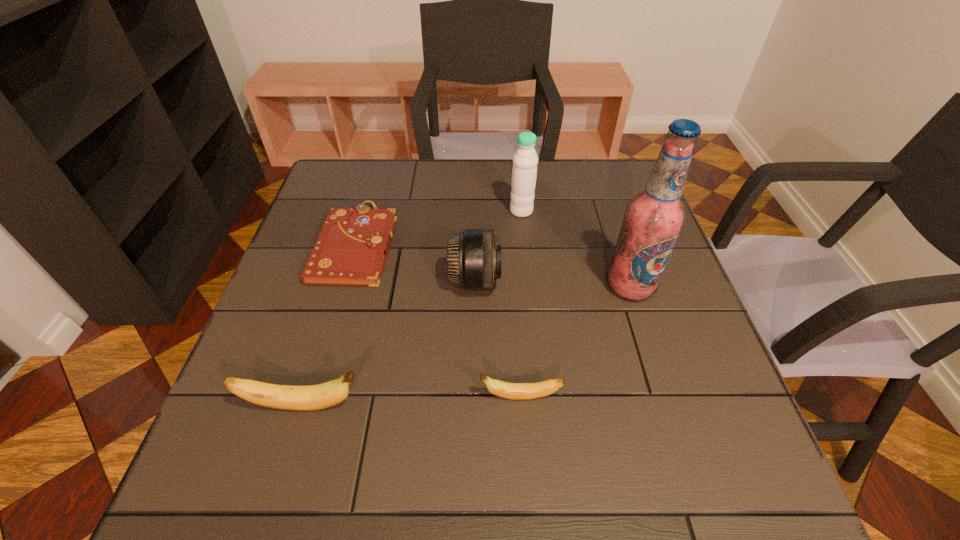
Where is `unoccupied position between the right banana and the telephoto lens`? unoccupied position between the right banana and the telephoto lens is located at coordinates (497, 339).

At what (x,y) coordinates should I click in order to perform the action: click on unoccupied area between the fourth tallest object and the third tallest object. Please return your answer as a coordinate pair (x, y). The image size is (960, 540). Looking at the image, I should click on (390, 344).

The image size is (960, 540). Find the location of `empty space between the shorter banana and the rightmost object`. empty space between the shorter banana and the rightmost object is located at coordinates (575, 342).

The image size is (960, 540). I want to click on vacant point located between the right banana and the tallest object, so click(x=575, y=342).

Locate an element on the screen. The height and width of the screenshot is (540, 960). free space that is in between the telephoto lens and the tallest object is located at coordinates (553, 284).

The height and width of the screenshot is (540, 960). What are the coordinates of `vacant region between the tallest object and the telephoto lens` in the screenshot? It's located at (553, 284).

Find the location of `free space between the fourth shortest object and the tallest object`. free space between the fourth shortest object and the tallest object is located at coordinates pyautogui.click(x=553, y=284).

At what (x,y) coordinates should I click in order to perform the action: click on object that is the closest to the third shortest object. Please return your answer as a coordinate pair (x, y). This screenshot has width=960, height=540. Looking at the image, I should click on (516, 391).

Locate which object is the third closest to the alcohol. Please provide its 2D coordinates. Your answer should be formatted as a tuple, i.e. [(x, y)], where the tuple contains the x and y coordinates of a point satisfying the conditions above.

[(516, 391)]

Locate an element on the screen. The image size is (960, 540). vacant region that satisfies the following two spatial constraints: 1. on the back side of the water bottle; 2. on the left side of the notebook is located at coordinates (366, 211).